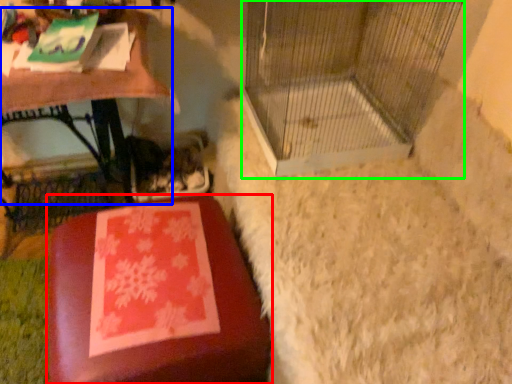
Question: Estimate the real-world distances between objects in this image. Which object is closer to furniture (highlighted by a red box), table (highlighted by a blue box) or bird cage (highlighted by a green box)?

Choices:
 (A) table
 (B) bird cage

Answer: (A)